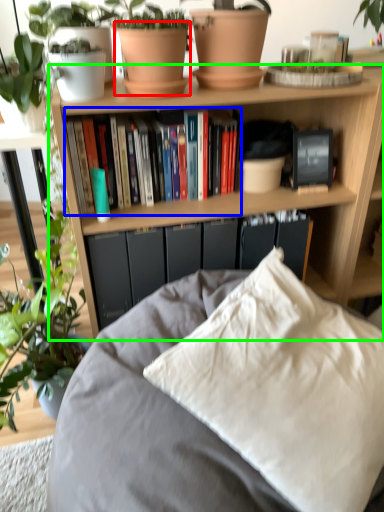
Question: Which object is positioned closest to flowerpot (highlighted by a red box)? Select from book (highlighted by a blue box) and bookcase (highlighted by a green box).

Choices:
 (A) book
 (B) bookcase

Answer: (A)